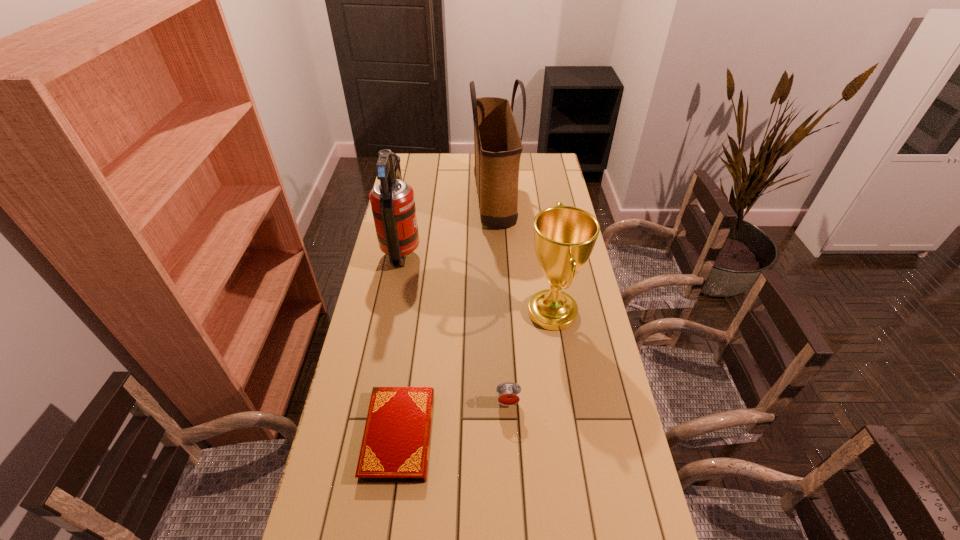
Where is `vacant region at the far left corner`? The width and height of the screenshot is (960, 540). vacant region at the far left corner is located at coordinates (431, 165).

The width and height of the screenshot is (960, 540). Identify the location of vacant point at the far right corner. (538, 156).

Locate an element on the screen. empty space between the tote bag and the third shortest object is located at coordinates (523, 256).

Image resolution: width=960 pixels, height=540 pixels. What are the coordinates of `vacant point located between the tote bag and the second shortest object` in the screenshot? It's located at (501, 301).

Find the location of a particular element. The width and height of the screenshot is (960, 540). free space between the fire extinguisher and the hardback book is located at coordinates (400, 343).

Find the location of `vacant region between the alarm clock and the shortest object`. vacant region between the alarm clock and the shortest object is located at coordinates (453, 418).

Locate an element on the screen. This screenshot has width=960, height=540. free space between the hardback book and the fire extinguisher is located at coordinates (400, 343).

The width and height of the screenshot is (960, 540). In order to click on vacant area that lies between the hardback book and the third farthest object in this screenshot , I will do `click(475, 374)`.

The width and height of the screenshot is (960, 540). Find the location of `free space between the tote bag and the third farthest object`. free space between the tote bag and the third farthest object is located at coordinates (523, 256).

Locate an element on the screen. This screenshot has height=540, width=960. vacant space that is in between the fire extinguisher and the third tallest object is located at coordinates (477, 282).